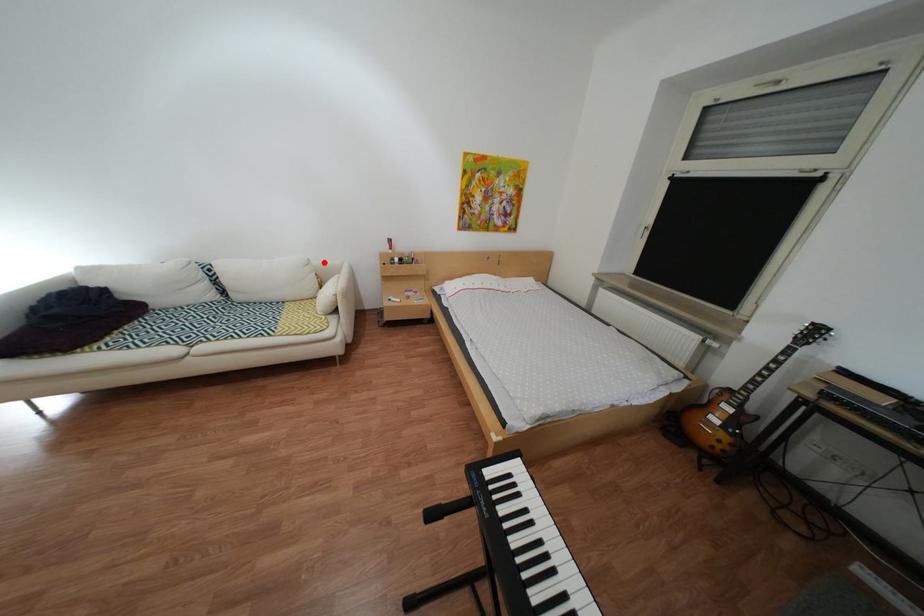
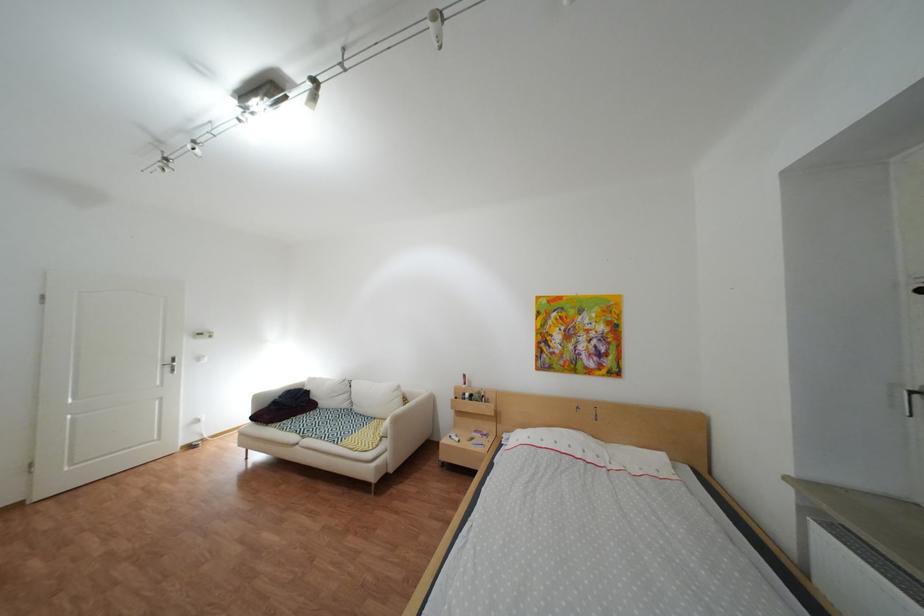
The point at the highlighted location is marked in the first image. Where is the corresponding point in the second image?

(415, 389)